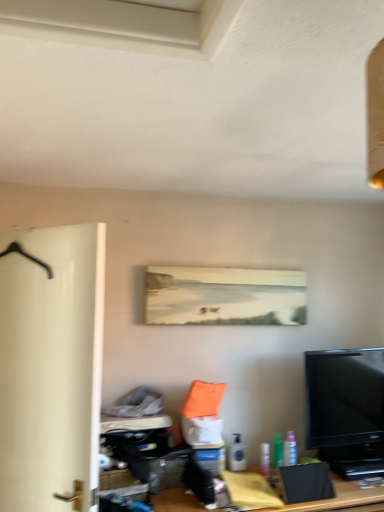
Question: From the image's perspective, would you say wooden desk at center is positioned over black glossy tv at lower right?

Choices:
 (A) no
 (B) yes

Answer: (A)

Question: Is wooden desk at center located outside black glossy tv at lower right?

Choices:
 (A) no
 (B) yes

Answer: (B)

Question: Is wooden desk at center smaller than black glossy tv at lower right?

Choices:
 (A) yes
 (B) no

Answer: (B)

Question: Does wooden desk at center have a greater height compared to black glossy tv at lower right?

Choices:
 (A) yes
 (B) no

Answer: (B)

Question: Does wooden desk at center have a greater width compared to black glossy tv at lower right?

Choices:
 (A) no
 (B) yes

Answer: (B)

Question: Would you say black glossy tv at lower right is part of wooden desk at center's contents?

Choices:
 (A) yes
 (B) no

Answer: (B)

Question: Considering the relative sizes of translucent plastic spray can at lower center, the third toiletry when ordered from right to left, and green plastic bottle at lower right, the second toiletry positioned from the right, in the image provided, is translucent plastic spray can at lower center, the third toiletry when ordered from right to left, smaller than green plastic bottle at lower right, the second toiletry positioned from the right,?

Choices:
 (A) yes
 (B) no

Answer: (B)

Question: From the image's perspective, is translucent plastic spray can at lower center, which appears as the first toiletry when viewed from the left, on green plastic bottle at lower right, the second toiletry positioned from the right?

Choices:
 (A) yes
 (B) no

Answer: (A)

Question: Is translucent plastic spray can at lower center, which appears as the first toiletry when viewed from the left, far from green plastic bottle at lower right, acting as the second toiletry starting from the left?

Choices:
 (A) yes
 (B) no

Answer: (B)

Question: Is translucent plastic spray can at lower center, which appears as the first toiletry when viewed from the left, placed right next to green plastic bottle at lower right, the second toiletry positioned from the right?

Choices:
 (A) yes
 (B) no

Answer: (B)

Question: Considering the relative positions of translucent plastic spray can at lower center, the third toiletry when ordered from right to left, and green plastic bottle at lower right, acting as the second toiletry starting from the left, in the image provided, is translucent plastic spray can at lower center, the third toiletry when ordered from right to left, to the right of green plastic bottle at lower right, acting as the second toiletry starting from the left, from the viewer's perspective?

Choices:
 (A) yes
 (B) no

Answer: (B)

Question: From a real-world perspective, is translucent plastic spray can at lower center, which appears as the first toiletry when viewed from the left, on top of green plastic bottle at lower right, the second toiletry positioned from the right?

Choices:
 (A) no
 (B) yes

Answer: (A)

Question: Does white matte door at left have a smaller size compared to translucent plastic spray can at lower center, which appears as the first toiletry when viewed from the left?

Choices:
 (A) yes
 (B) no

Answer: (B)